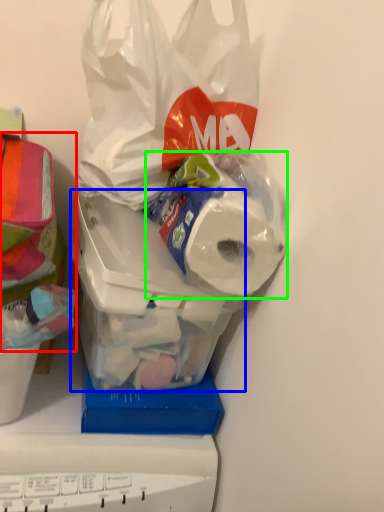
Question: Estimate the real-world distances between objects in this image. Which object is farther from wrapping paper (highlighted by a red box), wide (highlighted by a blue box) or toilet paper (highlighted by a green box)?

Choices:
 (A) wide
 (B) toilet paper

Answer: (B)